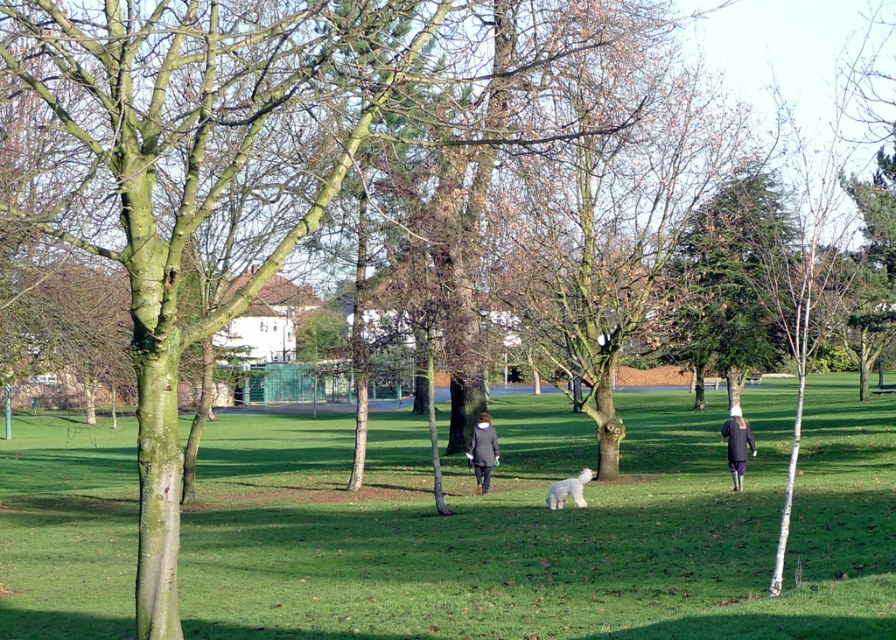
Who is more forward, (750, 435) or (556, 506)?

Positioned in front is point (556, 506).

Between purple fabric pants at right and white fluffy dog at center, which one is positioned lower?

white fluffy dog at center is below.

Which is in front, point (742, 433) or point (582, 499)?

Point (582, 499) is more forward.

The height and width of the screenshot is (640, 896). In order to click on purple fabric pants at right in this screenshot , I will do `click(737, 444)`.

Is green grassy at center closer to camera compared to white fluffy dog at center?

Yes, it is.

Is point (712, 461) positioned behind point (573, 480)?

Yes, it is behind point (573, 480).

Locate an element on the screen. The width and height of the screenshot is (896, 640). green grassy at center is located at coordinates (548, 525).

Is dark gray wool coat at center wider than purple fabric pants at right?

In fact, dark gray wool coat at center might be narrower than purple fabric pants at right.

Which is in front, point (483, 492) or point (738, 404)?

Point (483, 492) is in front.

The width and height of the screenshot is (896, 640). Describe the element at coordinates (481, 451) in the screenshot. I see `dark gray wool coat at center` at that location.

Where is `dark gray wool coat at center`? The height and width of the screenshot is (640, 896). dark gray wool coat at center is located at coordinates (481, 451).